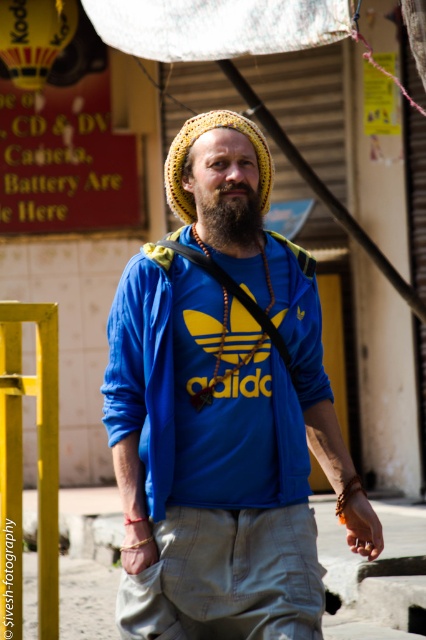
You are a GUI agent. You are given a task and a screenshot of the screen. Output one action in this format:
    pyautogui.click(x=<x>, y=<y>)
    Task: Click on the brown sand at lower center
    
    Given the screenshot: What is the action you would take?
    pyautogui.click(x=89, y=563)

Image resolution: width=426 pixels, height=640 pixels. What do you see at coordinates (89, 563) in the screenshot?
I see `brown sand at lower center` at bounding box center [89, 563].

This screenshot has height=640, width=426. Find the location of `brown sand at lower center`. brown sand at lower center is located at coordinates (89, 563).

You are a GUI agent. You are given a task and a screenshot of the screen. Output one action in this format:
    pyautogui.click(x=<x>, y=<y>)
    Task: Click on the brown sand at lower center
    The height and width of the screenshot is (640, 426).
    Given the screenshot: What is the action you would take?
    pyautogui.click(x=89, y=563)

Looking at this image, which is more to the right, blue cotton t-shirt at center or beardsoft/fuzzyat center?

From the viewer's perspective, beardsoft/fuzzyat center appears more on the right side.

Can you confirm if blue cotton t-shirt at center is bigger than beardsoft/fuzzyat center?

Indeed, blue cotton t-shirt at center has a larger size compared to beardsoft/fuzzyat center.

Locate an element on the screen. blue cotton t-shirt at center is located at coordinates click(x=143, y=371).

Does blue cotton t-shirt at center have a lesser height compared to brown sand at lower center?

Incorrect, blue cotton t-shirt at center's height does not fall short of brown sand at lower center's.

Is blue cotton t-shirt at center thinner than brown sand at lower center?

No, blue cotton t-shirt at center is not thinner than brown sand at lower center.

Between point (302, 298) and point (109, 548), which one is positioned behind?

Positioned behind is point (109, 548).

What are the coordinates of `blue cotton t-shirt at center` in the screenshot? It's located at (143, 371).